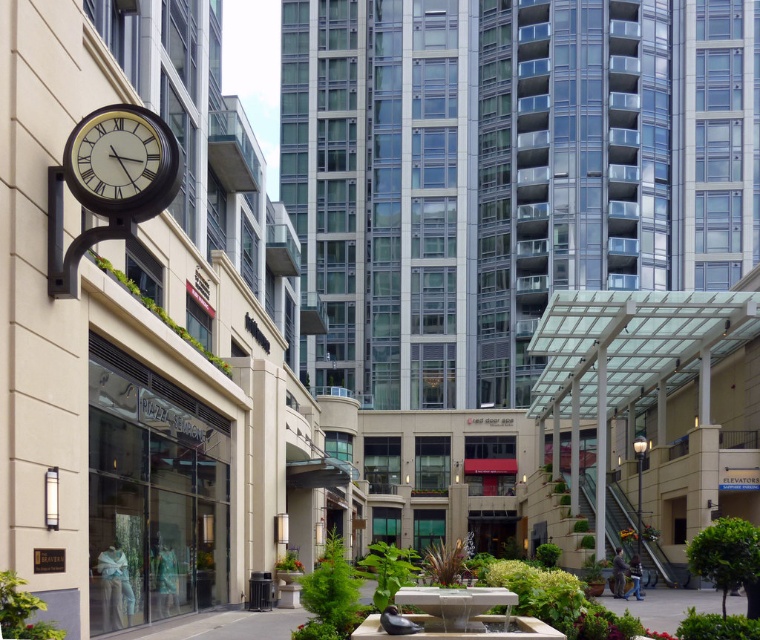
Between matte white clock at upper left and white stone fountain at center, which one has less height?

Standing shorter between the two is white stone fountain at center.

Who is lower down, matte white clock at upper left or white stone fountain at center?

Positioned lower is white stone fountain at center.

At what (x,y) coordinates should I click in order to perform the action: click on matte white clock at upper left. Please return your answer as a coordinate pair (x, y). This screenshot has width=760, height=640. Looking at the image, I should click on (122, 163).

I want to click on matte white clock at upper left, so click(x=122, y=163).